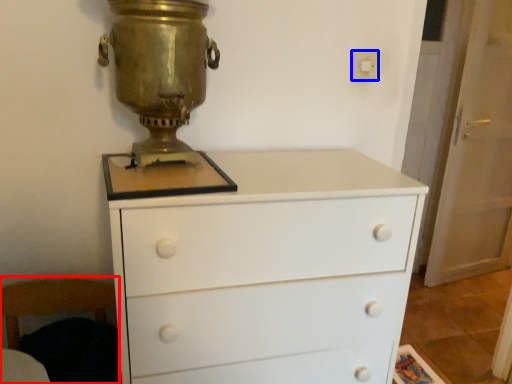
Question: Which object is closer to the camera taking this photo, armchair (highlighted by a red box) or electric outlet (highlighted by a blue box)?

Choices:
 (A) armchair
 (B) electric outlet

Answer: (A)